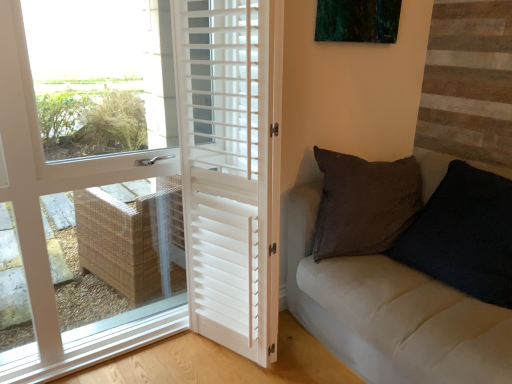
This screenshot has height=384, width=512. I want to click on white matte door at left, which is counted as the first door, starting from the left, so click(x=140, y=172).

Find the location of `velvet black pillow at right`. velvet black pillow at right is located at coordinates (391, 313).

Which is closer to the camera, (275, 112) or (220, 216)?

The point (275, 112) is more forward.

Between white matte shutters at center, which appears as the second door when viewed from the left, and white matte door at left, the second door in the right-to-left sequence, which one has smaller size?

white matte shutters at center, which appears as the second door when viewed from the left, is smaller.

From the picture: From a real-world perspective, does white matte shutters at center, which appears as the second door when viewed from the left, sit lower than white matte door at left, the second door in the right-to-left sequence?

Yes, from a real-world perspective, white matte shutters at center, which appears as the second door when viewed from the left, is under white matte door at left, the second door in the right-to-left sequence.

From the image's perspective, would you say white matte shutters at center, which is the first door in right-to-left order, is positioned over white matte door at left, which is counted as the first door, starting from the left?

No, from the image's perspective, white matte shutters at center, which is the first door in right-to-left order, is not above white matte door at left, which is counted as the first door, starting from the left.

Is the surface of white matte door at left, which is counted as the first door, starting from the left, in direct contact with velvet black pillow at right?

No.

Does white matte door at left, the second door in the right-to-left sequence, have a smaller size compared to velvet black pillow at right?

No.

Considering the sizes of objects white matte door at left, which is counted as the first door, starting from the left, and velvet black pillow at right in the image provided, who is wider, white matte door at left, which is counted as the first door, starting from the left, or velvet black pillow at right?

velvet black pillow at right is wider.

Considering the relative positions of white matte door at left, which is counted as the first door, starting from the left, and velvet black pillow at right in the image provided, is white matte door at left, which is counted as the first door, starting from the left, in front of velvet black pillow at right?

That is True.

Which is in front, white matte door at left, the second door in the right-to-left sequence, or white matte shutters at center, which appears as the second door when viewed from the left?

white matte door at left, the second door in the right-to-left sequence, is more forward.

In the scene shown: Is white matte door at left, the second door in the right-to-left sequence, turned away from white matte shutters at center, which appears as the second door when viewed from the left?

Yes, white matte shutters at center, which appears as the second door when viewed from the left, is at the back of white matte door at left, the second door in the right-to-left sequence.

At what (x,y) coordinates should I click in order to perform the action: click on door in front of the white matte shutters at center, which appears as the second door when viewed from the left. Please return your answer as a coordinate pair (x, y). Image resolution: width=512 pixels, height=384 pixels. Looking at the image, I should click on (140, 172).

Is white matte door at left, which is counted as the first door, starting from the left, not close to white matte shutters at center, which is the first door in right-to-left order?

white matte door at left, which is counted as the first door, starting from the left, is actually quite close to white matte shutters at center, which is the first door in right-to-left order.

Does velvet black pillow at right appear on the left side of white matte door at left, which is counted as the first door, starting from the left?

Incorrect, velvet black pillow at right is not on the left side of white matte door at left, which is counted as the first door, starting from the left.

Choose the correct answer: Is velvet black pillow at right inside white matte door at left, which is counted as the first door, starting from the left, or outside it?

velvet black pillow at right is not enclosed by white matte door at left, which is counted as the first door, starting from the left.

This screenshot has width=512, height=384. Identify the location of studio couch lying below the white matte door at left, which is counted as the first door, starting from the left (from the image's perspective). [391, 313].

What's the angular difference between velvet black pillow at right and white matte door at left, the second door in the right-to-left sequence,'s facing directions?

89.9 degrees separate the facing orientations of velvet black pillow at right and white matte door at left, the second door in the right-to-left sequence.

Can you confirm if white matte shutters at center, which is the first door in right-to-left order, is smaller than velvet black pillow at right?

Yes.

Locate an element on the screen. The height and width of the screenshot is (384, 512). studio couch below the white matte shutters at center, which appears as the second door when viewed from the left (from a real-world perspective) is located at coordinates (391, 313).

Does white matte shutters at center, which is the first door in right-to-left order, have a greater width compared to velvet black pillow at right?

No.

Consider the image. Is white matte shutters at center, which is the first door in right-to-left order, facing towards velvet black pillow at right?

No, white matte shutters at center, which is the first door in right-to-left order, is not aimed at velvet black pillow at right.

Which of these two, velvet black pillow at right or white matte shutters at center, which is the first door in right-to-left order, is wider?

velvet black pillow at right.

Does velvet black pillow at right lie in front of white matte shutters at center, which is the first door in right-to-left order?

Yes, velvet black pillow at right is closer to the viewer.

Considering the sizes of velvet black pillow at right and white matte shutters at center, which appears as the second door when viewed from the left, in the image, is velvet black pillow at right bigger or smaller than white matte shutters at center, which appears as the second door when viewed from the left,?

In the image, velvet black pillow at right appears to be larger than white matte shutters at center, which appears as the second door when viewed from the left.

Is velvet black pillow at right far from white matte shutters at center, which appears as the second door when viewed from the left?

No, velvet black pillow at right is in close proximity to white matte shutters at center, which appears as the second door when viewed from the left.

Where is `door above the white matte shutters at center, which is the first door in right-to-left order (from the image's perspective)`? This screenshot has width=512, height=384. door above the white matte shutters at center, which is the first door in right-to-left order (from the image's perspective) is located at coordinates (140, 172).

In order to click on the 2nd door counting from the left side of the velvet black pillow at right in this screenshot , I will do `click(140, 172)`.

Based on their spatial positions, is white matte shutters at center, which is the first door in right-to-left order, or white matte door at left, which is counted as the first door, starting from the left, closer to velvet black pillow at right?

Based on the image, white matte shutters at center, which is the first door in right-to-left order, appears to be nearer to velvet black pillow at right.

From the image, which object appears to be nearer to white matte door at left, which is counted as the first door, starting from the left, white matte shutters at center, which appears as the second door when viewed from the left, or velvet black pillow at right?

Based on the image, white matte shutters at center, which appears as the second door when viewed from the left, appears to be nearer to white matte door at left, which is counted as the first door, starting from the left.

Estimate the real-world distances between objects in this image. Which object is closer to white matte shutters at center, which appears as the second door when viewed from the left, velvet black pillow at right or white matte door at left, the second door in the right-to-left sequence?

Among the two, white matte door at left, the second door in the right-to-left sequence, is located nearer to white matte shutters at center, which appears as the second door when viewed from the left.

Looking at the image, which one is located closer to velvet black pillow at right, white matte door at left, which is counted as the first door, starting from the left, or white matte shutters at center, which appears as the second door when viewed from the left?

white matte shutters at center, which appears as the second door when viewed from the left, is closer to velvet black pillow at right.

Which object lies nearer to the anchor point white matte shutters at center, which appears as the second door when viewed from the left, white matte door at left, the second door in the right-to-left sequence, or velvet black pillow at right?

The object closer to white matte shutters at center, which appears as the second door when viewed from the left, is white matte door at left, the second door in the right-to-left sequence.

Estimate the real-world distances between objects in this image. Which object is closer to white matte door at left, which is counted as the first door, starting from the left, velvet black pillow at right or white matte shutters at center, which appears as the second door when viewed from the left?

Among the two, white matte shutters at center, which appears as the second door when viewed from the left, is located nearer to white matte door at left, which is counted as the first door, starting from the left.

Identify the location of door situated between white matte door at left, the second door in the right-to-left sequence, and velvet black pillow at right from left to right. This screenshot has width=512, height=384. (230, 167).